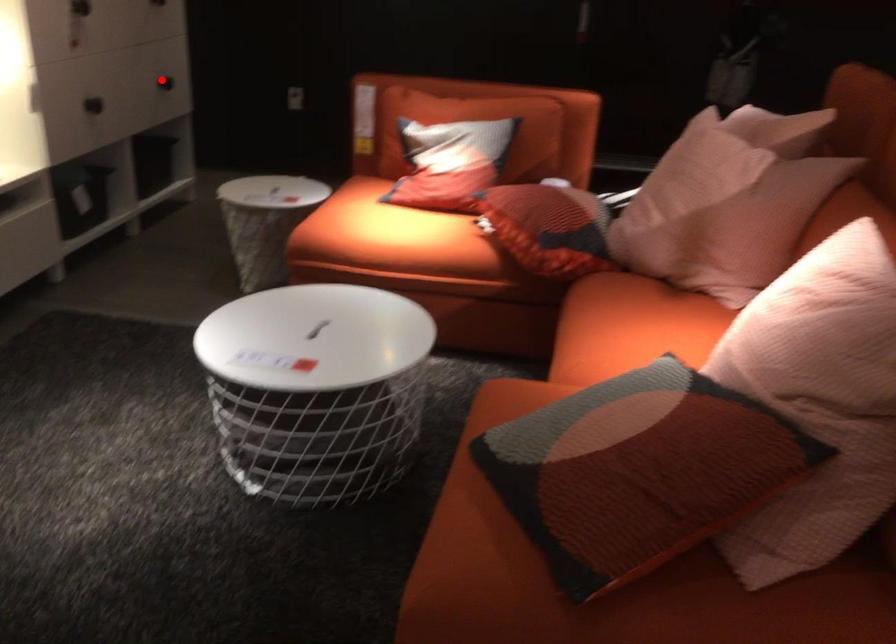
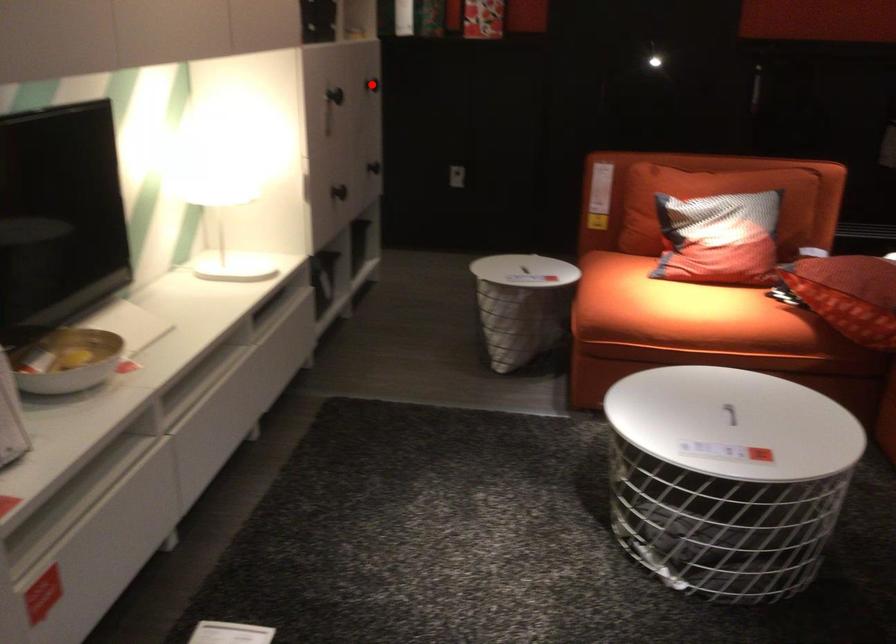
I am providing you with two images of the same scene from different viewpoints. A red point is marked on the first image and another point is marked on the second image. Is the red point in image1 aligned with the point shown in image2?

No